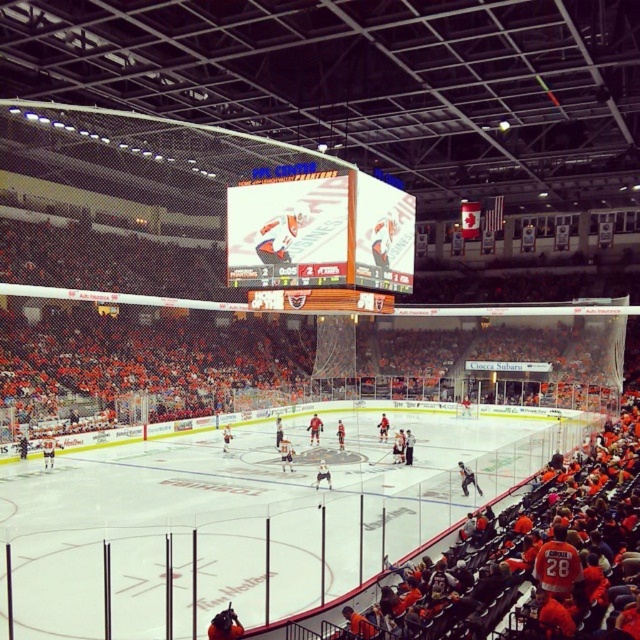
You are a photographer standing at the edge of the ice rink. You want to take a photo of the orange jersey at center without the wooden scoreboard at center blocking the view. Is this possible?

The wooden scoreboard at center is located above the orange jersey at center, so the scoreboard would block the view of the orange jersey at center from your current position. Move to a position where you can angle your camera downward to capture the orange jersey at center without the scoreboard obscuring it.

You are a player in the ice hockey arena. You notice the white ice at center and the white glossy jersey at center. Which object is positioned higher from the ground?

The white ice at center is located above the white glossy jersey at center, so the white ice at center is higher from the ground.

You are a spectator at the game and want to take a photo of the white ice at center and the shiny black jersey at center. Which object should you focus on first if you want to capture both in the same frame without moving your camera?

The white ice at center is positioned on the left side of the shiny black jersey at center. Since they are both at center, you can focus on one and adjust your camera angle slightly to include both in the frame without moving the camera.